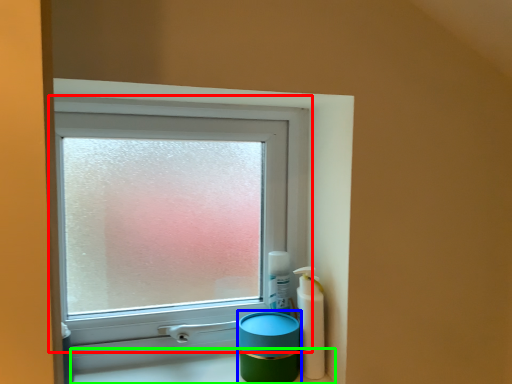
Question: Estimate the real-world distances between objects in this image. Which object is farther from window (highlighted by a red box), teal (highlighted by a blue box) or counter top (highlighted by a green box)?

Choices:
 (A) teal
 (B) counter top

Answer: (B)